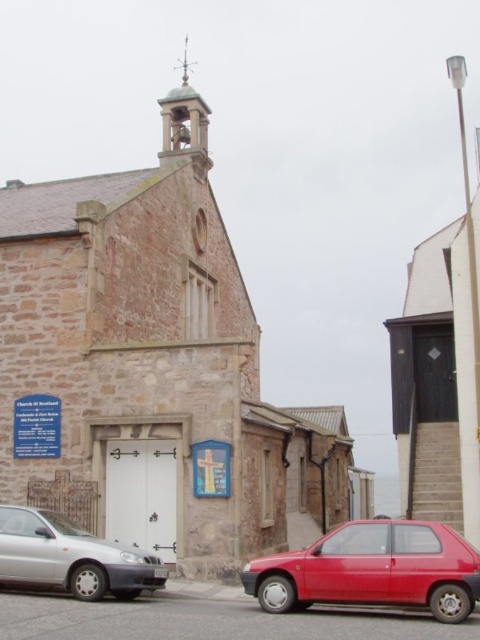
You are standing in front of the church and want to take a photo of the silver metallic car at lower left and the metallic bell tower at upper center. Which object should you focus on first if you want both to be in clear focus?

You should focus on the silver metallic car at lower left first because it is closer to you than the metallic bell tower at upper center. By focusing on the closer object, the bell tower will also be in focus due to the depth of field.

You are standing at the entrance of the church and want to reach the point marked by point (396, 536) and point (84, 596). Which point is closer to you?

Point (396, 536) is closer to you because it is in front of point (84, 596).

You are a visitor arriving at the church and need to park your car. You see a shiny red car at lower right and a silver metallic car at lower left. Which car is parked above the other?

The shiny red car at lower right is positioned under the silver metallic car at lower left, so the silver metallic car at lower left is parked above the shiny red car at lower right.